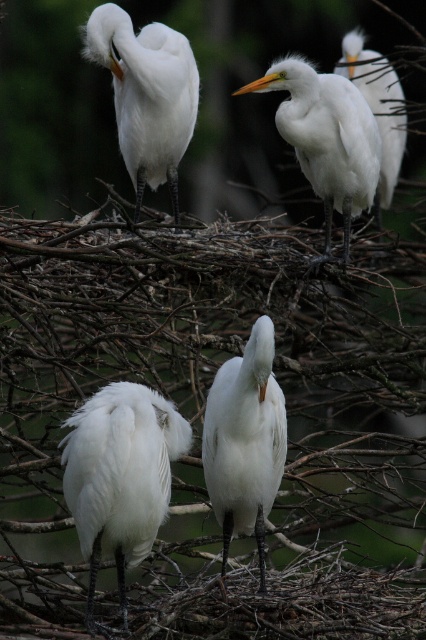
Can you confirm if white matte bird at center is bigger than white feathered egret at upper right?

No, white matte bird at center is not bigger than white feathered egret at upper right.

Between white matte bird at center and white feathered egret at upper right, which one is positioned higher?

white feathered egret at upper right is higher up.

Describe the element at coordinates (244, 442) in the screenshot. I see `white matte bird at center` at that location.

At what (x,y) coordinates should I click in order to perform the action: click on white matte bird at center. Please return your answer as a coordinate pair (x, y). Image resolution: width=426 pixels, height=640 pixels. Looking at the image, I should click on (244, 442).

Does white fluffy bird at lower left have a lesser width compared to white feathered egret at upper right?

Yes.

Between point (115, 529) and point (340, 61), which one is positioned behind?

Positioned behind is point (340, 61).

At what (x,y) coordinates should I click in order to perform the action: click on white fluffy bird at lower left. Please return your answer as a coordinate pair (x, y). The image size is (426, 640). Looking at the image, I should click on (120, 477).

This screenshot has width=426, height=640. In order to click on white fluffy bird at lower left in this screenshot , I will do `click(120, 477)`.

Which is below, matte white egret at upper left or white feathered egret at upper right?

matte white egret at upper left is below.

Who is more forward, [152,97] or [356,74]?

Point [152,97] is more forward.

Who is more distant from viewer, (169, 106) or (359, 72)?

The point (359, 72) is more distant.

I want to click on matte white egret at upper left, so click(x=146, y=93).